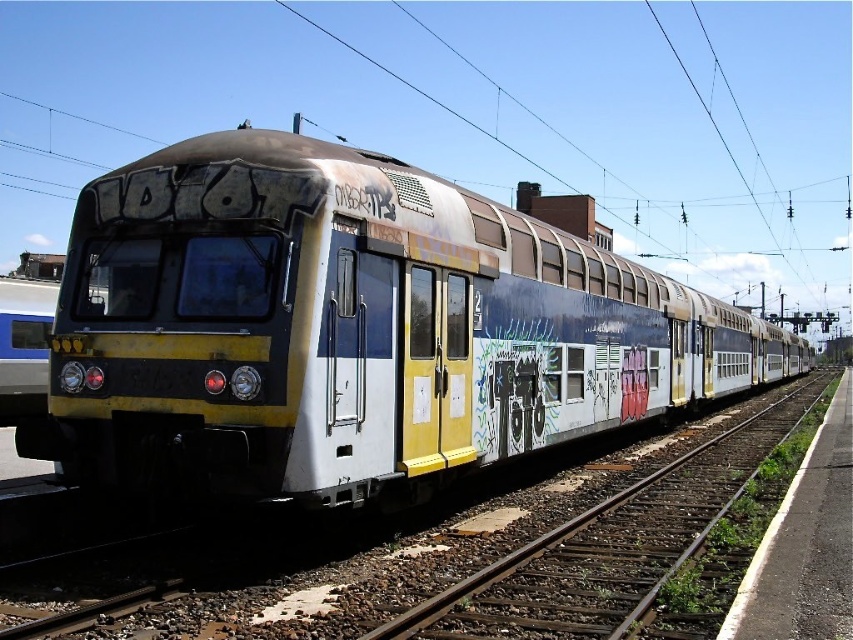
The height and width of the screenshot is (640, 853). What are the coordinates of `yellow matte train at center` in the screenshot? It's located at (351, 328).

Which is more to the left, yellow matte train at center or smooth metal train track at center?

From the viewer's perspective, smooth metal train track at center appears more on the left side.

This screenshot has height=640, width=853. Identify the location of yellow matte train at center. (351, 328).

Locate an element on the screen. This screenshot has height=640, width=853. yellow matte train at center is located at coordinates (351, 328).